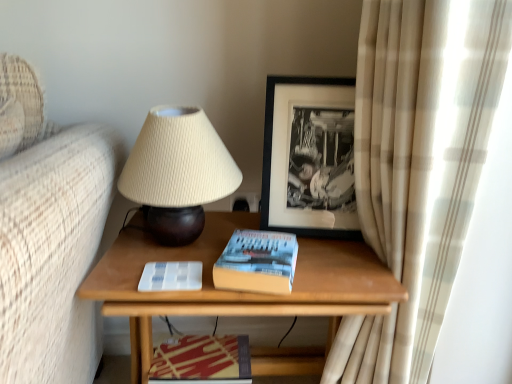
Question: Is wooden table at center bigger than hardcover book at center?

Choices:
 (A) yes
 (B) no

Answer: (A)

Question: Is wooden table at center wider than hardcover book at center?

Choices:
 (A) no
 (B) yes

Answer: (B)

Question: Is wooden table at center taller than hardcover book at center?

Choices:
 (A) no
 (B) yes

Answer: (B)

Question: Is there a large distance between wooden table at center and hardcover book at center?

Choices:
 (A) no
 (B) yes

Answer: (A)

Question: From the image's perspective, is wooden table at center on top of hardcover book at center?

Choices:
 (A) no
 (B) yes

Answer: (A)

Question: In terms of size, does wooden table at center appear bigger or smaller than hardcover book at center?

Choices:
 (A) small
 (B) big

Answer: (B)

Question: From the image's perspective, relative to hardcover book at center, is wooden table at center above or below?

Choices:
 (A) below
 (B) above

Answer: (A)

Question: Which is correct: wooden table at center is inside hardcover book at center, or outside of it?

Choices:
 (A) inside
 (B) outside

Answer: (B)

Question: Considering the positions of wooden table at center and hardcover book at center in the image, is wooden table at center taller or shorter than hardcover book at center?

Choices:
 (A) tall
 (B) short

Answer: (A)

Question: Is hardcover book at center bigger or smaller than beige plaid curtain at right?

Choices:
 (A) big
 (B) small

Answer: (B)

Question: Is hardcover book at center in front of or behind beige plaid curtain at right in the image?

Choices:
 (A) behind
 (B) front

Answer: (A)

Question: Is point (222, 261) positioned closer to the camera than point (418, 160)?

Choices:
 (A) closer
 (B) farther

Answer: (B)

Question: In the image, is hardcover book at center on the left side or the right side of beige plaid curtain at right?

Choices:
 (A) right
 (B) left

Answer: (B)

Question: Does point (169, 215) appear closer or farther from the camera than point (218, 355)?

Choices:
 (A) farther
 (B) closer

Answer: (B)

Question: Considering the relative positions of beige ribbed fabric lampshade at upper center and red glossy magazine at lower center in the image provided, is beige ribbed fabric lampshade at upper center to the left or to the right of red glossy magazine at lower center?

Choices:
 (A) left
 (B) right

Answer: (A)